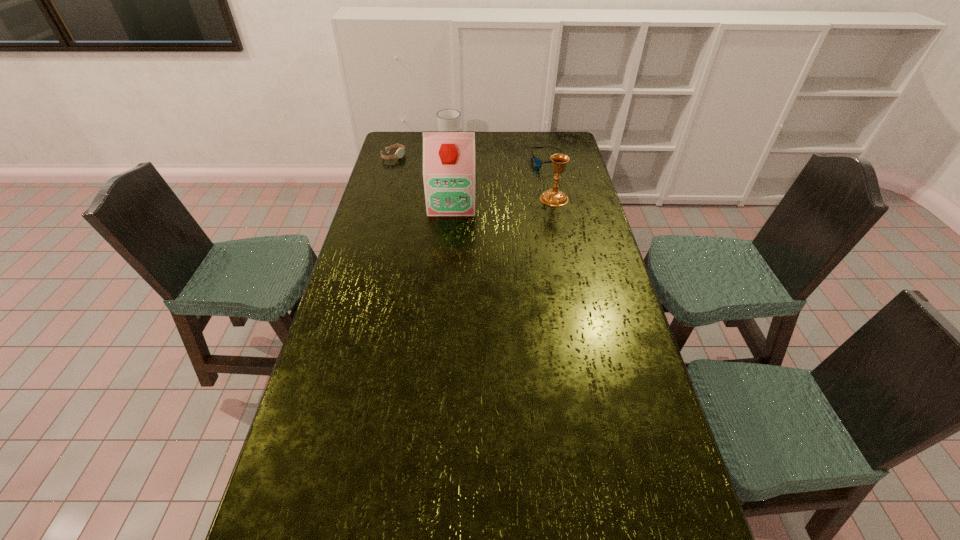
Locate an element on the screen. soya milk is located at coordinates (448, 156).

This screenshot has height=540, width=960. I want to click on chalice, so click(553, 197).

Find the location of `the farthest object`. the farthest object is located at coordinates (448, 119).

This screenshot has width=960, height=540. Find the location of `the third shortest object`. the third shortest object is located at coordinates [448, 119].

The height and width of the screenshot is (540, 960). What are the coordinates of `watch` in the screenshot? It's located at (x=400, y=152).

At what (x,y) coordinates should I click in order to perform the action: click on the leftmost object. Please return your answer as a coordinate pair (x, y). The image size is (960, 540). Looking at the image, I should click on (400, 152).

You are a GUI agent. You are given a task and a screenshot of the screen. Output one action in this format:
    pyautogui.click(x=<x>, y=<y>)
    Task: Click on the sunglasses
    
    Given the screenshot: What is the action you would take?
    pyautogui.click(x=538, y=163)

Locate an element on the screen. The width and height of the screenshot is (960, 540). vacant space located 0.230m with the cap open on the tallest object is located at coordinates (448, 254).

In order to click on free space located on the back of the chalice in this screenshot , I will do `click(544, 151)`.

At what (x,y) coordinates should I click in order to perform the action: click on vacant space located with a handle on the side of the third shortest object. Please return your answer as a coordinate pair (x, y). Image resolution: width=960 pixels, height=540 pixels. Looking at the image, I should click on (476, 166).